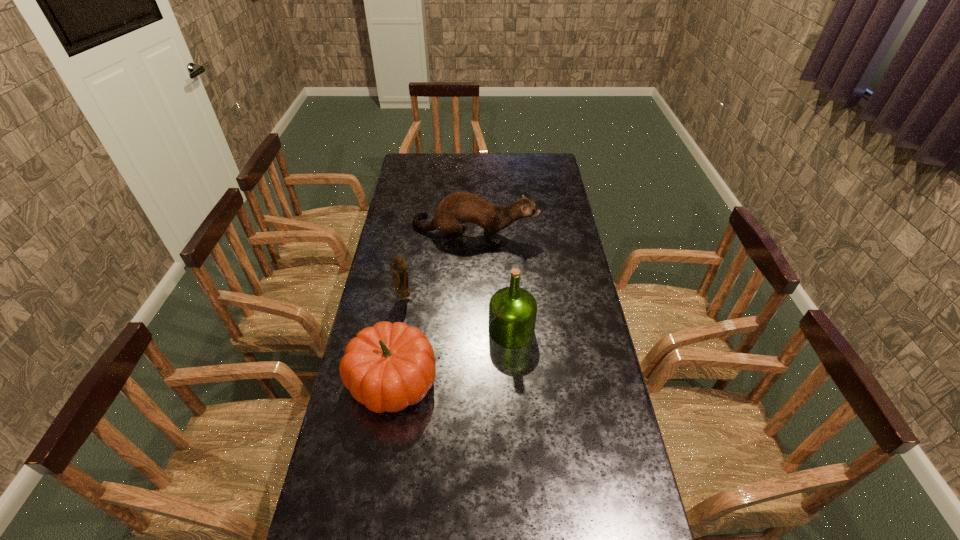
Locate an element on the screen. The image size is (960, 540). free space between the pumpkin and the farthest object is located at coordinates (434, 306).

Locate which object is the closest to the pumpkin. Please provide its 2D coordinates. Your answer should be formatted as a tuple, i.e. [(x, y)], where the tuple contains the x and y coordinates of a point satisfying the conditions above.

[(512, 310)]

Identify which object is located as the nearest to the pumpkin. Please provide its 2D coordinates. Your answer should be formatted as a tuple, i.e. [(x, y)], where the tuple contains the x and y coordinates of a point satisfying the conditions above.

[(512, 310)]

The height and width of the screenshot is (540, 960). I want to click on free location that satisfies the following two spatial constraints: 1. on the front-facing side of the third nearest object; 2. on the right side of the tallest object, so click(x=399, y=330).

Locate an element on the screen. This screenshot has height=540, width=960. free space in the image that satisfies the following two spatial constraints: 1. at the face of the farthest object; 2. on the right side of the tallest object is located at coordinates (472, 330).

This screenshot has height=540, width=960. Find the location of `free spot that satisfies the following two spatial constraints: 1. at the face of the farthest object; 2. on the front-facing side of the figurine`. free spot that satisfies the following two spatial constraints: 1. at the face of the farthest object; 2. on the front-facing side of the figurine is located at coordinates click(473, 298).

Where is `free space that satisfies the following two spatial constraints: 1. on the front-facing side of the figurine; 2. on the right side of the pumpkin`? free space that satisfies the following two spatial constraints: 1. on the front-facing side of the figurine; 2. on the right side of the pumpkin is located at coordinates (391, 381).

You are a GUI agent. You are given a task and a screenshot of the screen. Output one action in this format:
    pyautogui.click(x=<x>, y=<y>)
    Task: Click on the vacant area in the image that satisfies the following two spatial constraints: 1. at the face of the farthest object; 2. on the front-facing side of the figurine
    
    Given the screenshot: What is the action you would take?
    coord(473,298)

You are a GUI agent. You are given a task and a screenshot of the screen. Output one action in this format:
    pyautogui.click(x=<x>, y=<y>)
    Task: Click on the free space that satisfies the following two spatial constraints: 1. on the front-facing side of the olive oil; 2. on the right side of the figurine
    The image size is (960, 540).
    Given the screenshot: What is the action you would take?
    pyautogui.click(x=399, y=330)